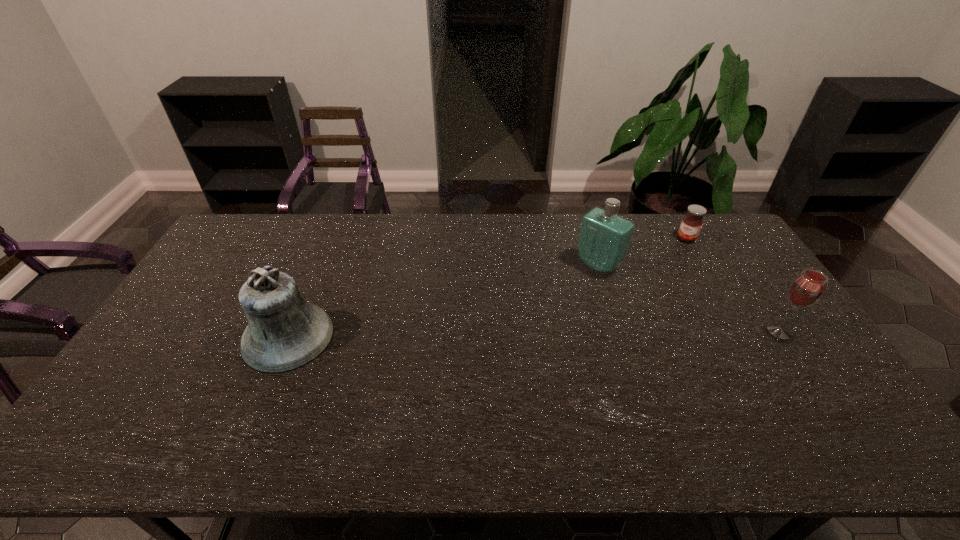
Locate an element on the screen. free location located on the front label of the third object from right to left is located at coordinates (535, 321).

This screenshot has height=540, width=960. What are the coordinates of `vacant space located on the front label of the third object from right to left` in the screenshot? It's located at (577, 284).

This screenshot has height=540, width=960. I want to click on blank space located on the label side of the farthest object, so click(677, 249).

Locate an element on the screen. The height and width of the screenshot is (540, 960). vacant area situated 0.170m on the label side of the farthest object is located at coordinates (662, 266).

You are a GUI agent. You are given a task and a screenshot of the screen. Output one action in this format:
    pyautogui.click(x=<x>, y=<y>)
    Task: Click on the vacant space located on the label side of the farthest object
    This screenshot has width=960, height=540.
    Given the screenshot: What is the action you would take?
    pyautogui.click(x=644, y=286)

What are the coordinates of `perfume at the far edge` in the screenshot? It's located at (604, 239).

This screenshot has width=960, height=540. What are the coordinates of `jam present at the far edge` in the screenshot? It's located at (692, 222).

At what (x,y) coordinates should I click in order to perform the action: click on wineglass that is positioned at the right edge. Please return your answer as a coordinate pair (x, y). Looking at the image, I should click on (806, 289).

This screenshot has width=960, height=540. What are the coordinates of `jam located in the right edge section of the desktop` in the screenshot? It's located at (692, 222).

Identify the location of object located in the far right corner section of the desktop. The height and width of the screenshot is (540, 960). (692, 222).